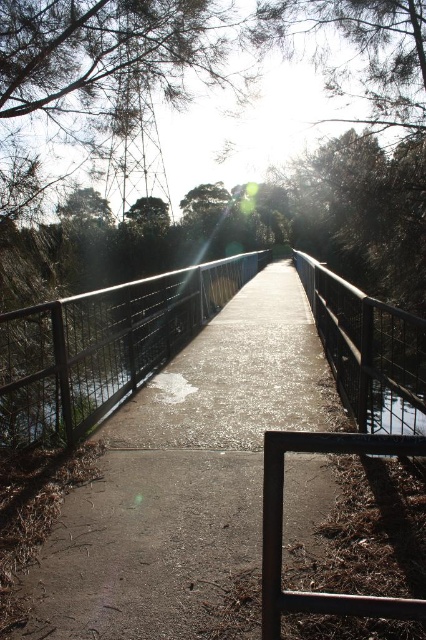
Between point (276, 424) and point (270, 588), which one is positioned in front?

Point (270, 588) is more forward.

Can you confirm if concrete path at center is shorter than rusty metal balustrade at lower right?

No.

Find the location of `concrete path at center`. concrete path at center is located at coordinates (184, 477).